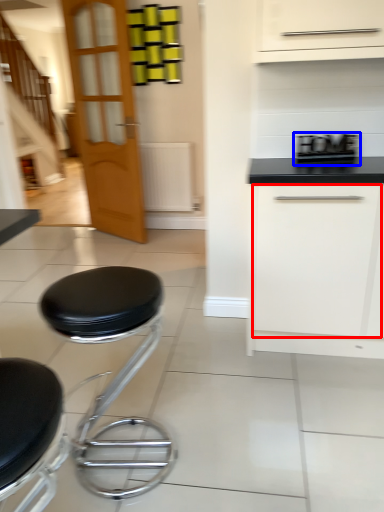
Question: Among these objects, which one is farthest to the camera, drawer (highlighted by a red box) or appliance (highlighted by a blue box)?

Choices:
 (A) drawer
 (B) appliance

Answer: (B)